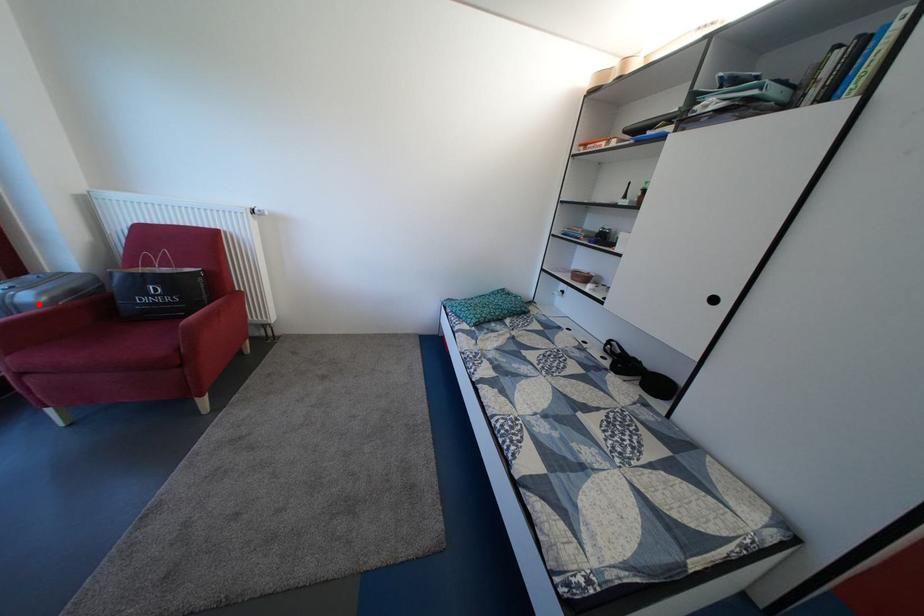
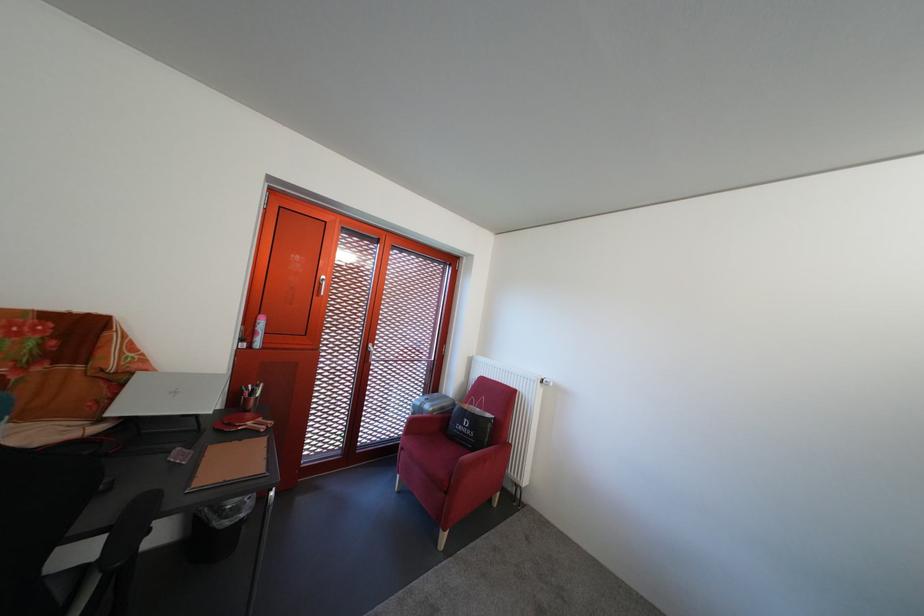
The point at the highlighted location is marked in the first image. Where is the corresponding point in the second image?

(439, 413)